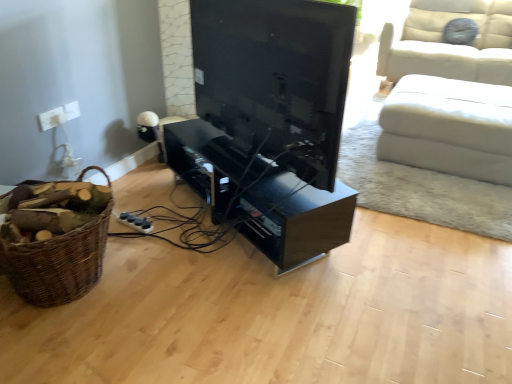
Question: Should I look upward or downward to see black glossy entertainment center at center?

Choices:
 (A) up
 (B) down

Answer: (A)

Question: Is black glossy entertainment center at center at the left side of brown woven basket at left?

Choices:
 (A) yes
 (B) no

Answer: (B)

Question: Is there a large distance between black glossy entertainment center at center and brown woven basket at left?

Choices:
 (A) yes
 (B) no

Answer: (B)

Question: Can you confirm if black glossy entertainment center at center is shorter than brown woven basket at left?

Choices:
 (A) no
 (B) yes

Answer: (B)

Question: Considering the relative sizes of black glossy entertainment center at center and brown woven basket at left in the image provided, is black glossy entertainment center at center smaller than brown woven basket at left?

Choices:
 (A) no
 (B) yes

Answer: (A)

Question: Does black glossy entertainment center at center turn towards brown woven basket at left?

Choices:
 (A) yes
 (B) no

Answer: (B)

Question: Considering the relative sizes of black glossy entertainment center at center and brown woven basket at left in the image provided, is black glossy entertainment center at center thinner than brown woven basket at left?

Choices:
 (A) yes
 (B) no

Answer: (B)

Question: Can you confirm if brown woven basket at left is smaller than white leather ottoman at right?

Choices:
 (A) no
 (B) yes

Answer: (B)

Question: From the image's perspective, is brown woven basket at left located above white leather ottoman at right?

Choices:
 (A) yes
 (B) no

Answer: (B)

Question: Is white leather ottoman at right at the back of brown woven basket at left?

Choices:
 (A) yes
 (B) no

Answer: (B)

Question: From the image's perspective, is brown woven basket at left under white leather ottoman at right?

Choices:
 (A) yes
 (B) no

Answer: (A)

Question: Does brown woven basket at left come in front of white leather ottoman at right?

Choices:
 (A) no
 (B) yes

Answer: (B)

Question: Is the surface of brown woven basket at left in direct contact with white leather ottoman at right?

Choices:
 (A) no
 (B) yes

Answer: (A)

Question: Does matte black tv at center turn towards white plastic socket at upper left?

Choices:
 (A) no
 (B) yes

Answer: (A)